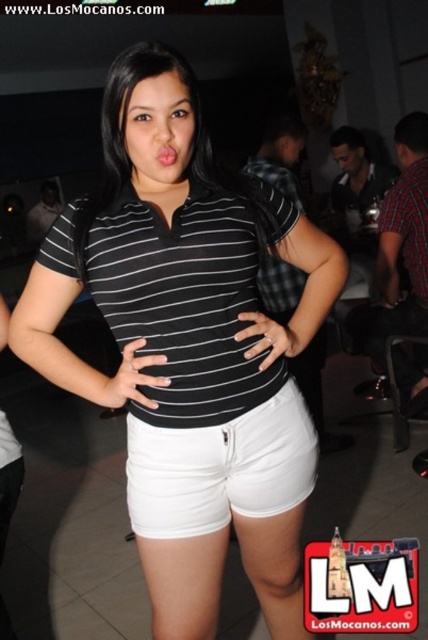
You are a photographer at this event and want to ensure the person in the matte black polo shirt at center and white cotton shorts at center is fully visible in the photo. Which clothing item should you focus on to make sure both are visible?

The matte black polo shirt at center is in front of the white cotton shorts at center, so focusing on the polo shirt will ensure both are visible as the shorts will be behind it.

You are a fashion designer analyzing the outfit of a person in an image. The person is wearing a matte black polo shirt at center and white cotton shorts at center. Based on the spatial relationship between these two items, can you determine which clothing item reaches higher on the body?

The matte black polo shirt at center is taller than white cotton shorts at center, so the polo shirt reaches higher on the body than the shorts.

Where is the black striped polo shirt at center located in the image?

The black striped polo shirt at center is located at point (184, 301).